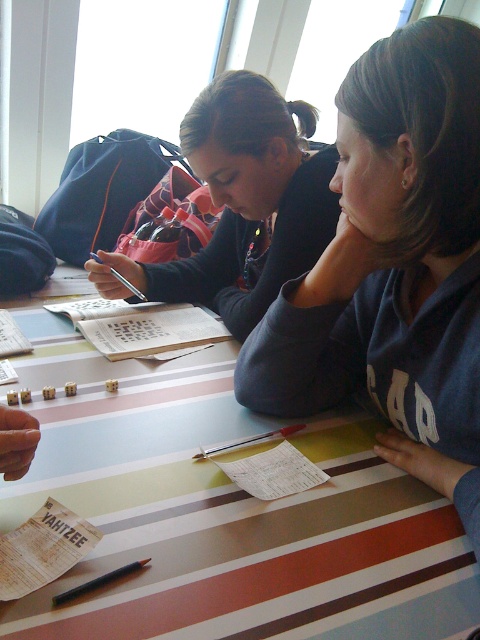
Question: Estimate the real-world distances between objects in this image. Which object is closer to the metallic pen at center?

Choices:
 (A) matte black sweater at upper center
 (B) black matte pen at lower left
 (C) striped paper at center

Answer: (C)

Question: Which point is farther to the camera?

Choices:
 (A) (228, 532)
 (B) (379, 120)

Answer: (B)

Question: From the image, what is the correct spatial relationship of striped paper at center in relation to metallic pen at center?

Choices:
 (A) above
 (B) below

Answer: (A)

Question: Which object is closer to the camera taking this photo?

Choices:
 (A) metallic pen at center
 (B) striped paper at center

Answer: (B)

Question: Can you confirm if matte black sweater at upper center is positioned to the right of metallic pen at center?

Choices:
 (A) no
 (B) yes

Answer: (A)

Question: Does striped paper at center have a greater width compared to dark gray sweatshirt at center?

Choices:
 (A) yes
 (B) no

Answer: (A)